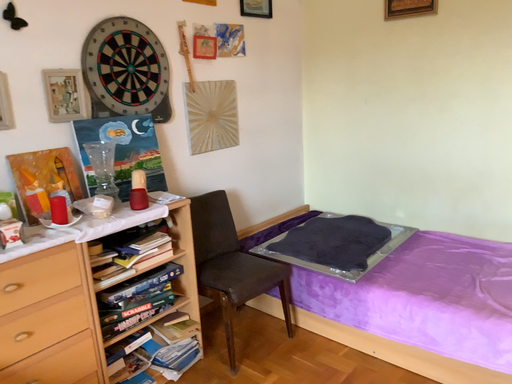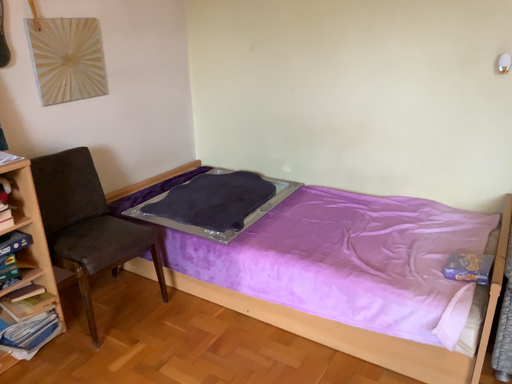
Question: How did the camera likely rotate when shooting the video?

Choices:
 (A) rotated left
 (B) rotated right

Answer: (B)